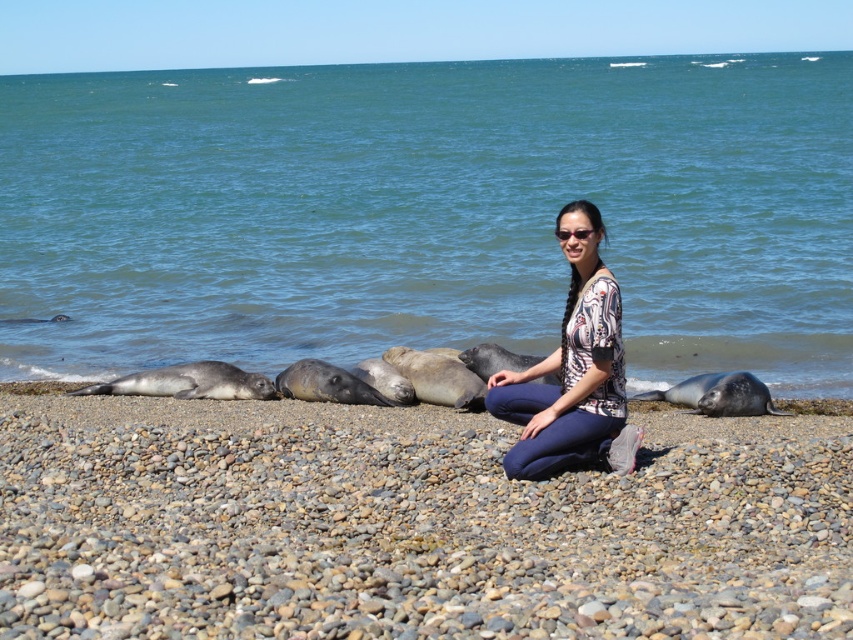
Question: Which of the following is the farthest from the observer?

Choices:
 (A) (630, 444)
 (B) (561, 83)
 (C) (641, 632)

Answer: (B)

Question: Is blue water at center thinner than printed fabric blouse at center?

Choices:
 (A) yes
 (B) no

Answer: (B)

Question: Does blue water at center appear on the left side of gray pebbled beach at center?

Choices:
 (A) no
 (B) yes

Answer: (B)

Question: Which point is closer to the camera?

Choices:
 (A) printed fabric blouse at center
 (B) blue water at center

Answer: (A)

Question: Which of the following is the closest to the observer?

Choices:
 (A) (767, 557)
 (B) (566, 422)
 (C) (300, 212)

Answer: (A)

Question: Observing the image, what is the correct spatial positioning of gray pebbled beach at center in reference to printed fabric blouse at center?

Choices:
 (A) below
 (B) above

Answer: (A)